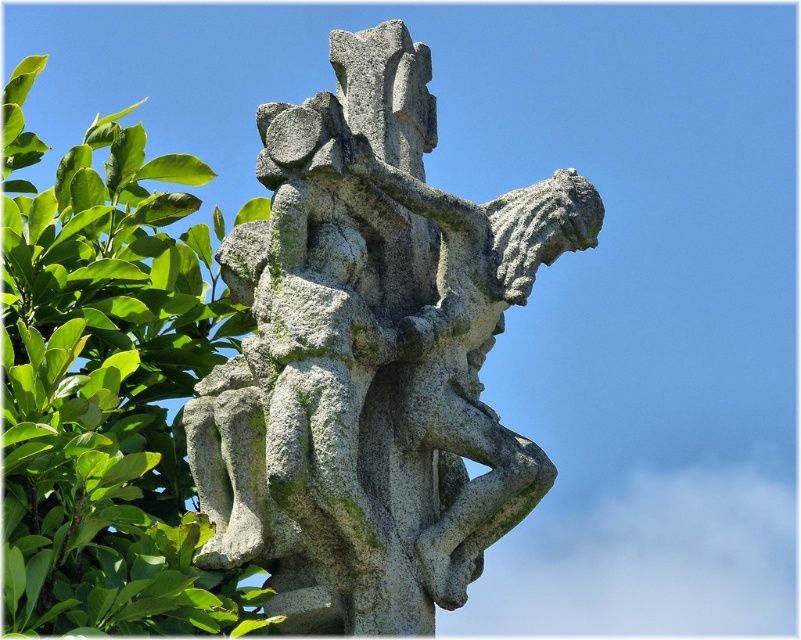
You are standing in front of a stone sculpture in a park. You notice a specific point marked at coordinates (369, 356). What does this point indicate?

The point at coordinates (369, 356) marks the gray stone sculpture at center.